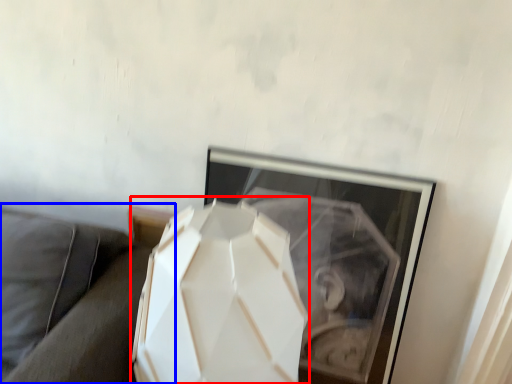
Question: Which object is further to the camera taking this photo, lamp (highlighted by a red box) or couch (highlighted by a blue box)?

Choices:
 (A) lamp
 (B) couch

Answer: (B)